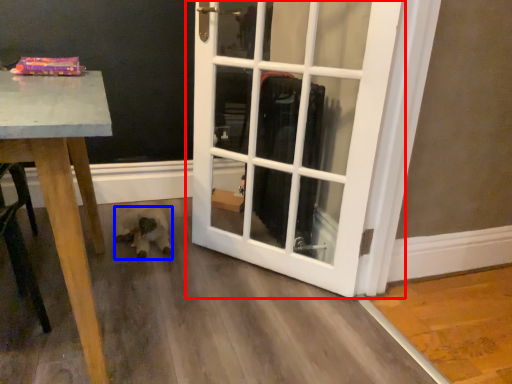
Question: Which of the following is the closest to the observer, door (highlighted by a red box) or animal (highlighted by a blue box)?

Choices:
 (A) door
 (B) animal

Answer: (A)